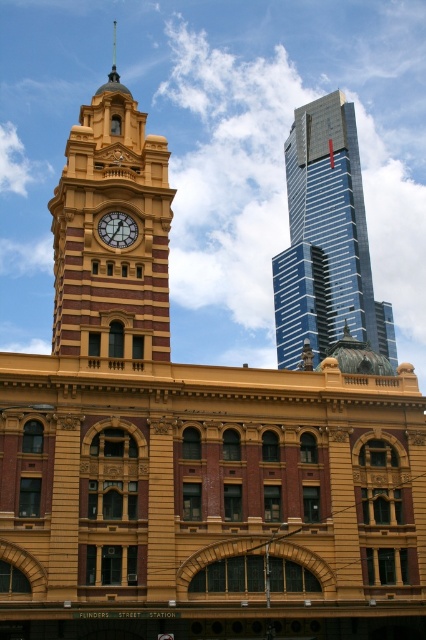
Question: Is matte yellow clock tower at center to the left of shiny glass skyscraper at upper right from the viewer's perspective?

Choices:
 (A) no
 (B) yes

Answer: (B)

Question: Which is farther from the shiny glass skyscraper at upper right?

Choices:
 (A) matte yellow clock tower at center
 (B) matte gold clock at center

Answer: (B)

Question: Which object is positioned closest to the matte gold clock at center?

Choices:
 (A) shiny glass skyscraper at upper right
 (B) matte yellow clock tower at center

Answer: (B)

Question: Estimate the real-world distances between objects in this image. Which object is closer to the matte gold clock at center?

Choices:
 (A) matte yellow clock tower at center
 (B) shiny glass skyscraper at upper right

Answer: (A)

Question: In this image, where is shiny glass skyscraper at upper right located relative to matte gold clock at center?

Choices:
 (A) left
 (B) right

Answer: (B)

Question: Does matte yellow clock tower at center lie in front of matte gold clock at center?

Choices:
 (A) yes
 (B) no

Answer: (A)